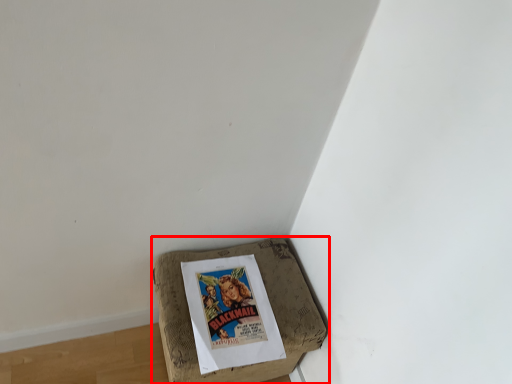
Question: From the image's perspective, considering the relative positions of furniture (annotated by the red box) and comic book in the image provided, where is furniture (annotated by the red box) located with respect to the staircase?

Choices:
 (A) above
 (B) below

Answer: (B)